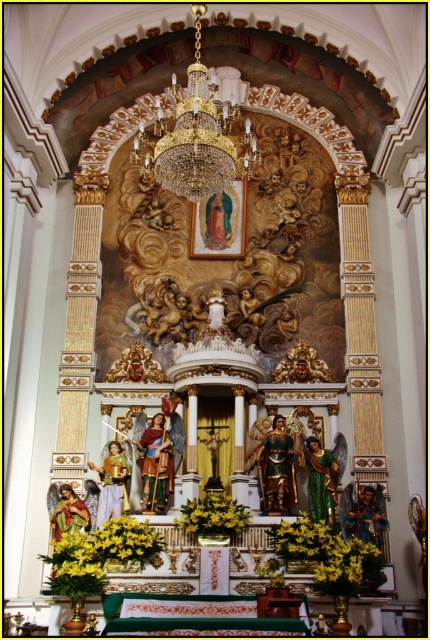
In the scene shown: Does yellow fabric flowers at lower left lie behind yellow fabric flower at center?

No, yellow fabric flowers at lower left is closer to the viewer.

This screenshot has height=640, width=430. What do you see at coordinates (107, 545) in the screenshot?
I see `yellow fabric flowers at lower left` at bounding box center [107, 545].

I want to click on yellow fabric flowers at lower left, so click(107, 545).

Is point (58, 573) more distant than point (300, 554)?

No.

Between point (73, 556) and point (366, 568), which one is positioned behind?

The point (366, 568) is behind.

Where is `yellow fabric flowers at lower left`? yellow fabric flowers at lower left is located at coordinates (107, 545).

Identify the location of yellow fabric flowers at lower left. (107, 545).

Can you confirm if yellow matte flowers at center is bigger than yellow fabric flower at center?

Indeed, yellow matte flowers at center has a larger size compared to yellow fabric flower at center.

Identify the location of yellow matte flowers at center. The image size is (430, 640). (304, 538).

Locate an element on the screen. This screenshot has width=430, height=640. yellow matte flowers at center is located at coordinates (304, 538).

You are a GUI agent. You are given a task and a screenshot of the screen. Output one action in this format:
    pyautogui.click(x=<x>, y=<y>)
    Task: Click on the yellow matte flowers at center
    
    Given the screenshot: What is the action you would take?
    pyautogui.click(x=304, y=538)